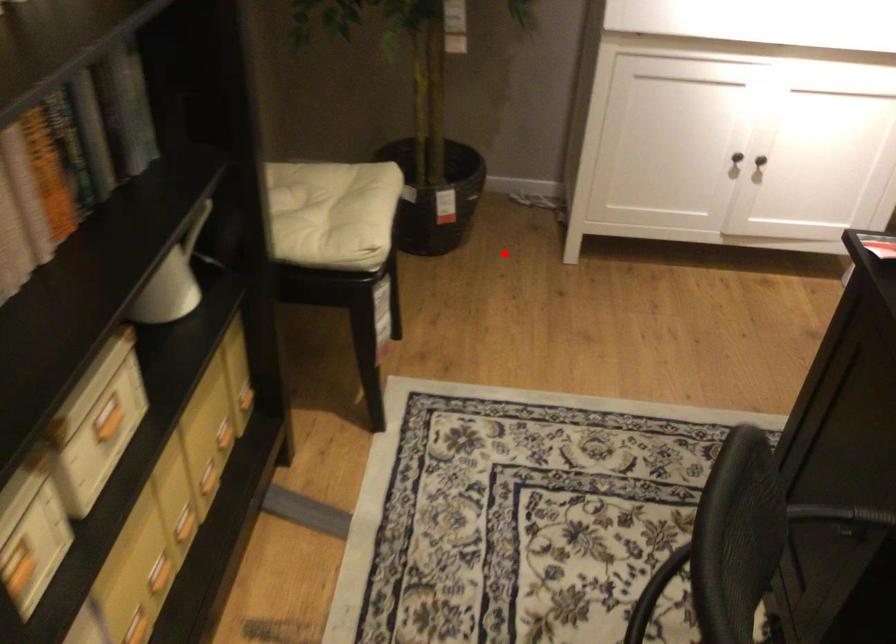
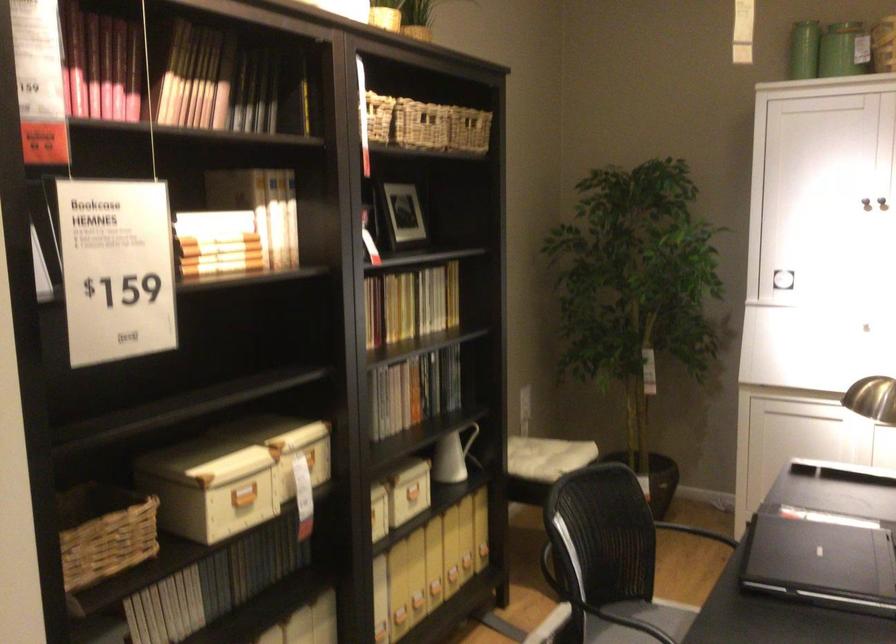
Question: I am providing you with two images of the same scene from different viewpoints. Image1 has a red point marked. In image2, the corresponding 3D location appears at what relative position? Reply with the corresponding letter.

Choices:
 (A) Closer
 (B) Farther

Answer: (B)